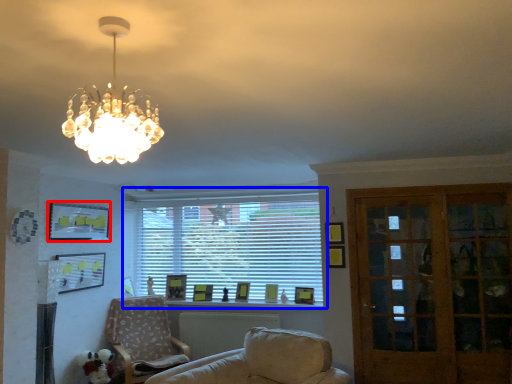
Question: Among these objects, which one is nearest to the camera, picture frame (highlighted by a red box) or window (highlighted by a blue box)?

Choices:
 (A) picture frame
 (B) window

Answer: (A)